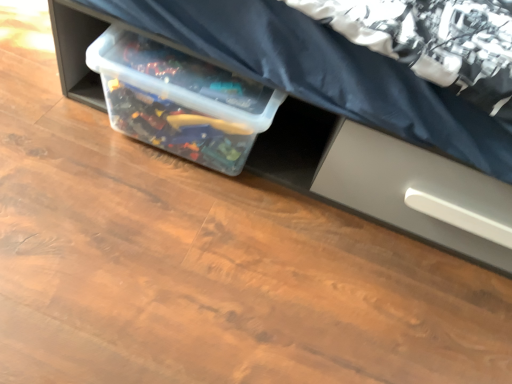
The width and height of the screenshot is (512, 384). In order to click on satin gray drawer at lower right in this screenshot , I will do `click(418, 193)`.

Identify the location of clear plastic storage bin at center. The image size is (512, 384). (386, 181).

Is transparent plastic container at center wider or thinner than satin gray drawer at lower right?

In the image, transparent plastic container at center appears to be more narrow than satin gray drawer at lower right.

Do you think transparent plastic container at center is within satin gray drawer at lower right, or outside of it?

transparent plastic container at center exists outside the volume of satin gray drawer at lower right.

From the image's perspective, is transparent plastic container at center below satin gray drawer at lower right?

Actually, transparent plastic container at center appears above satin gray drawer at lower right in the image.

From a real-world perspective, which object rests below the other?

In real-world perspective, transparent plastic container at center is lower.

From the image's perspective, is clear plastic storage bin at center located beneath transparent plastic container at center?

Actually, clear plastic storage bin at center appears above transparent plastic container at center in the image.

Would you consider clear plastic storage bin at center to be distant from transparent plastic container at center?

No, clear plastic storage bin at center is not far from transparent plastic container at center.

Measure the distance between clear plastic storage bin at center and transparent plastic container at center.

clear plastic storage bin at center and transparent plastic container at center are 10.66 inches apart from each other.

Does satin gray drawer at lower right have a larger size compared to transparent plastic container at center?

Yes, satin gray drawer at lower right is bigger than transparent plastic container at center.

I want to click on box on the left of the satin gray drawer at lower right, so click(180, 100).

Is satin gray drawer at lower right thinner than transparent plastic container at center?

Incorrect, the width of satin gray drawer at lower right is not less than that of transparent plastic container at center.

Does satin gray drawer at lower right appear on the right side of transparent plastic container at center?

Yes.

Is transparent plastic container at center far away from clear plastic storage bin at center?

transparent plastic container at center is actually quite close to clear plastic storage bin at center.

Is transparent plastic container at center turned away from clear plastic storage bin at center?

Yes, clear plastic storage bin at center is at the back of transparent plastic container at center.

Is transparent plastic container at center thinner than clear plastic storage bin at center?

Correct, the width of transparent plastic container at center is less than that of clear plastic storage bin at center.

Is point (424, 223) in front of point (332, 197)?

Yes, it is.

Is clear plastic storage bin at center placed right next to satin gray drawer at lower right?

Yes, the surface of clear plastic storage bin at center is in contact with satin gray drawer at lower right.

From a real-world perspective, who is located higher, satin gray drawer at lower right or clear plastic storage bin at center?

In real-world perspective, clear plastic storage bin at center is above.

Where is `furniture lying on the left of satin gray drawer at lower right`? This screenshot has width=512, height=384. furniture lying on the left of satin gray drawer at lower right is located at coordinates (386, 181).

From the image's perspective, is satin gray drawer at lower right above or below clear plastic storage bin at center?

Based on their image positions, satin gray drawer at lower right is located beneath clear plastic storage bin at center.

Looking at this image, could you tell me if satin gray drawer at lower right is turned towards clear plastic storage bin at center?

Yes, satin gray drawer at lower right is turned towards clear plastic storage bin at center.

This screenshot has height=384, width=512. I want to click on box behind the satin gray drawer at lower right, so click(x=180, y=100).

Identify the location of furniture that is above the transparent plastic container at center (from a real-world perspective). (386, 181).

Looking at the image, which one is located further to transparent plastic container at center, satin gray drawer at lower right or clear plastic storage bin at center?

Based on the image, satin gray drawer at lower right appears to be further to transparent plastic container at center.

Looking at the image, which one is located further to satin gray drawer at lower right, clear plastic storage bin at center or transparent plastic container at center?

transparent plastic container at center is positioned further to the anchor satin gray drawer at lower right.

Based on their spatial positions, is clear plastic storage bin at center or satin gray drawer at lower right closer to transparent plastic container at center?

Among the two, clear plastic storage bin at center is located nearer to transparent plastic container at center.

Considering their positions, is transparent plastic container at center positioned closer to satin gray drawer at lower right than clear plastic storage bin at center?

clear plastic storage bin at center lies closer to satin gray drawer at lower right than the other object.

From the image, which object appears to be nearer to clear plastic storage bin at center, transparent plastic container at center or satin gray drawer at lower right?

Based on the image, satin gray drawer at lower right appears to be nearer to clear plastic storage bin at center.

When comparing their distances from clear plastic storage bin at center, does satin gray drawer at lower right or transparent plastic container at center seem further?

transparent plastic container at center is further to clear plastic storage bin at center.

Find the location of a particular element. The image size is (512, 384). furniture between transparent plastic container at center and satin gray drawer at lower right in the horizontal direction is located at coordinates (386, 181).